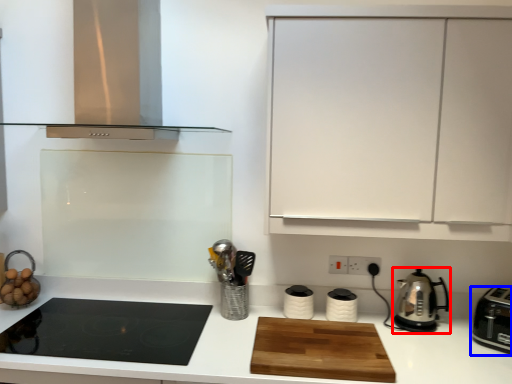
Question: Which object appears closest to the camera in this image, kitchen appliance (highlighted by a red box) or kitchen appliance (highlighted by a blue box)?

Choices:
 (A) kitchen appliance
 (B) kitchen appliance

Answer: (B)